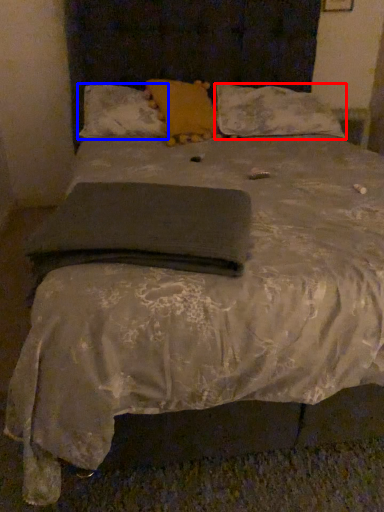
Question: Which point is further to the camera, pillow (highlighted by a red box) or pillow (highlighted by a blue box)?

Choices:
 (A) pillow
 (B) pillow

Answer: (A)